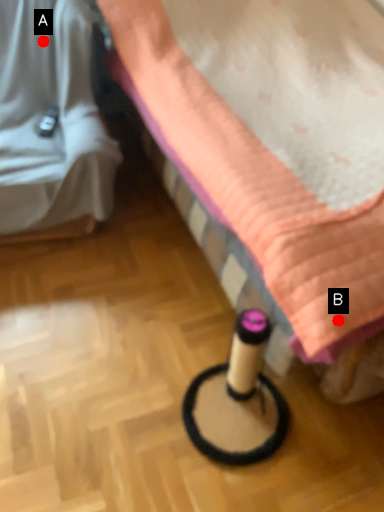
Question: Two points are circled on the image, labeled by A and B beside each circle. Among these points, which one is nearest to the camera?

Choices:
 (A) A is closer
 (B) B is closer

Answer: (B)